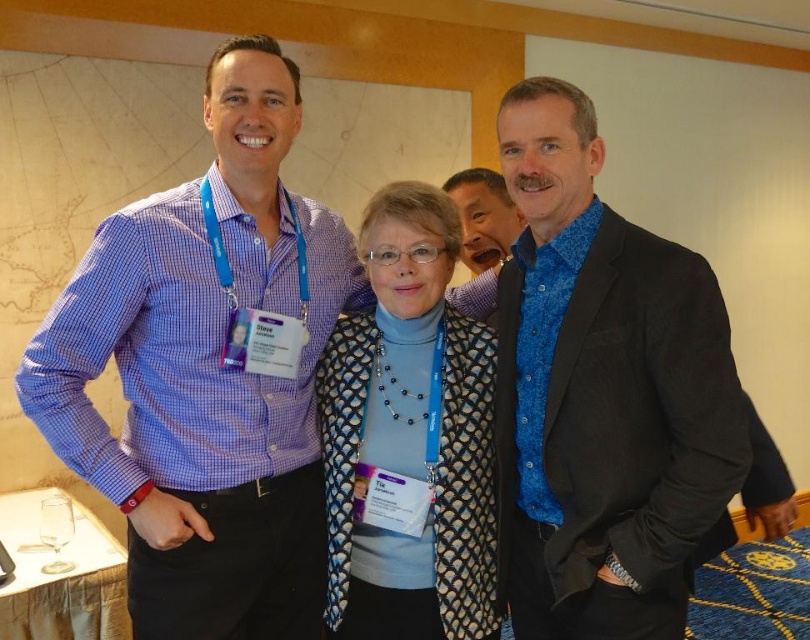
Question: Which object appears farthest from the camera in this image?

Choices:
 (A) blue textured shirt at center
 (B) matte blue shirt at left
 (C) blue textured sweater at center
 (D) blue satin shirt at center

Answer: (A)

Question: Is blue satin shirt at center further to the viewer compared to blue textured sweater at center?

Choices:
 (A) yes
 (B) no

Answer: (B)

Question: Can you confirm if blue satin shirt at center is positioned to the right of blue textured shirt at center?

Choices:
 (A) yes
 (B) no

Answer: (A)

Question: Can you confirm if blue satin shirt at center is bigger than blue textured sweater at center?

Choices:
 (A) no
 (B) yes

Answer: (B)

Question: Among these points, which one is nearest to the camera?

Choices:
 (A) pyautogui.click(x=689, y=273)
 (B) pyautogui.click(x=441, y=426)

Answer: (A)

Question: Which of the following is the closest to the observer?

Choices:
 (A) blue textured sweater at center
 (B) matte blue shirt at left
 (C) blue textured shirt at center
 (D) blue satin shirt at center

Answer: (D)